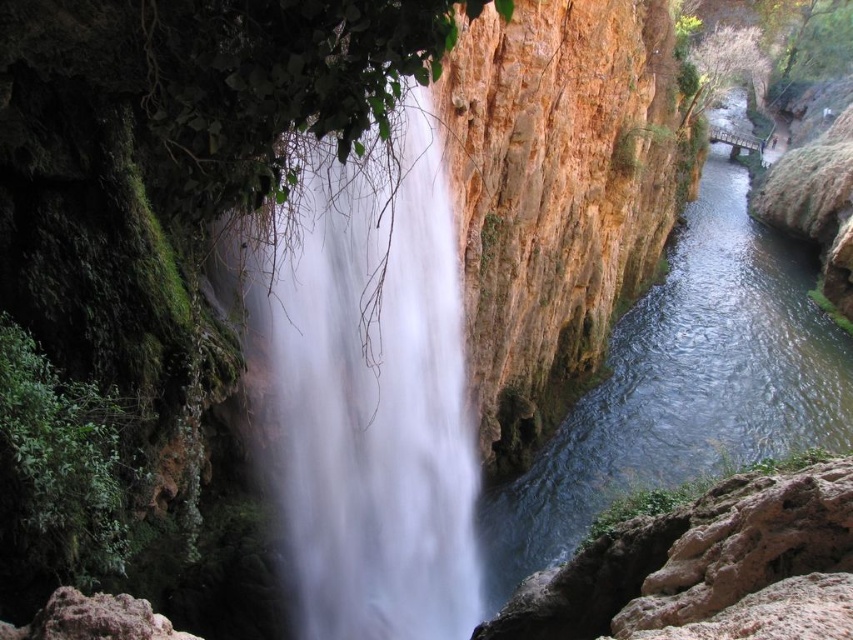
Question: Can you confirm if white smooth waterfall at center is positioned below brown rough rock at lower left?

Choices:
 (A) no
 (B) yes

Answer: (A)

Question: Which point is farther to the camera?

Choices:
 (A) white smooth waterfall at center
 (B) clear water at center right

Answer: (B)

Question: Which point appears farthest from the camera in this image?

Choices:
 (A) (291, 456)
 (B) (784, 316)

Answer: (B)

Question: Is white smooth waterfall at center below clear water at center right?

Choices:
 (A) no
 (B) yes

Answer: (B)

Question: Which point is farther to the camera?

Choices:
 (A) (706, 362)
 (B) (276, 294)

Answer: (A)

Question: Does white smooth waterfall at center appear on the right side of brown rough rock at lower left?

Choices:
 (A) yes
 (B) no

Answer: (A)